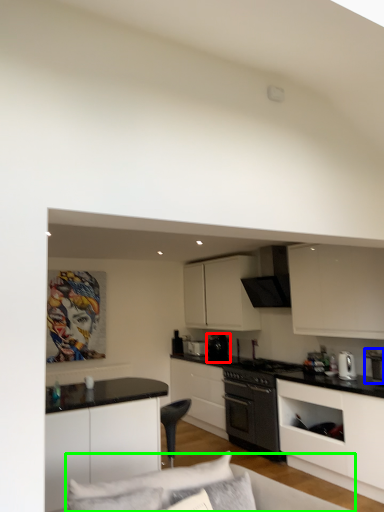
Question: Which is farther away from appliance (highlighted by a red box)? appliance (highlighted by a blue box) or couch (highlighted by a green box)?

Choices:
 (A) appliance
 (B) couch

Answer: (B)